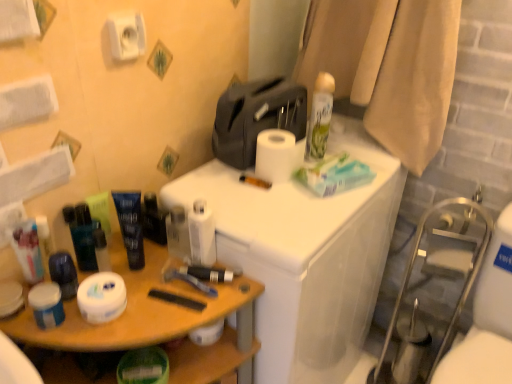
The width and height of the screenshot is (512, 384). Identify the location of free point to the left of white matte toilet paper at upper center, arranged as the 3th toilet paper when ordered from the bottom. (215, 183).